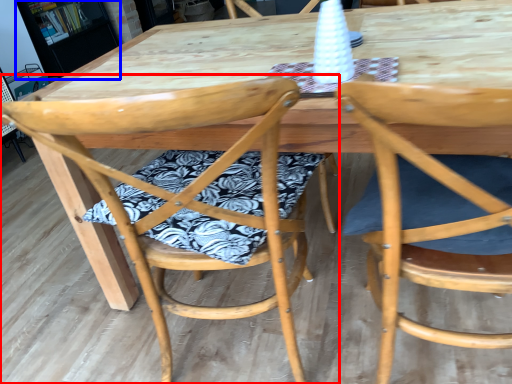
Question: Which point is closer to the camera, chair (highlighted by a red box) or bookshelf (highlighted by a blue box)?

Choices:
 (A) chair
 (B) bookshelf

Answer: (A)